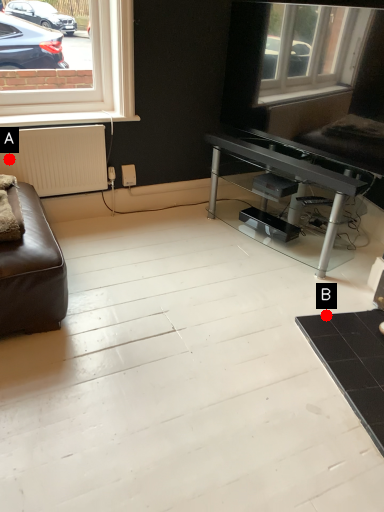
Question: Two points are circled on the image, labeled by A and B beside each circle. Which point is closer to the camera?

Choices:
 (A) A is closer
 (B) B is closer

Answer: (B)